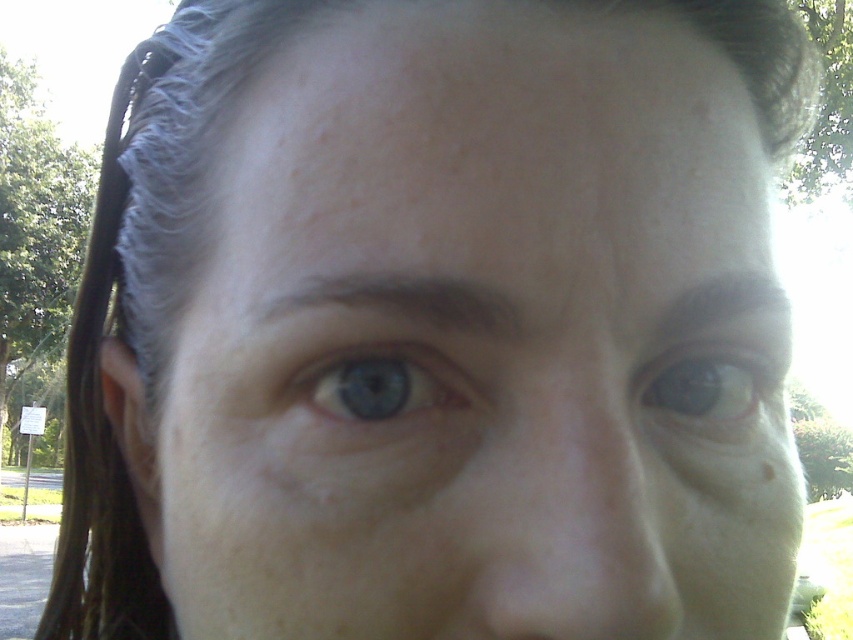
You are a photographer adjusting your camera settings to focus on the smooth skin face at center and the blue matte eye at center. Which object should you focus on first to ensure proper alignment with the camera lens?

The blue matte eye at center should be focused on first because the smooth skin face at center is below it, so focusing on the higher object first ensures proper alignment.

You are a photographer adjusting the focus of your camera. The subject has a smooth skin face at center and blue matte eye at center. Which object should you focus on to ensure the face is sharp? Explain your reasoning.

The smooth skin face at center is closer to the viewer than the blue matte eye at center. To ensure the face is sharp, focus on the smooth skin face at center because it is the closer object and proper focus on it will keep the eye in focus as well due to depth of field.